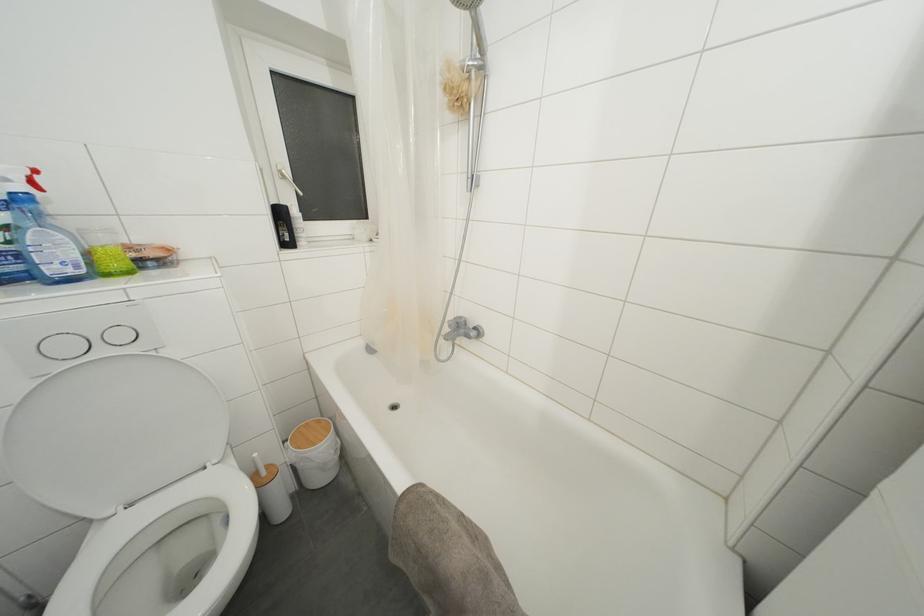
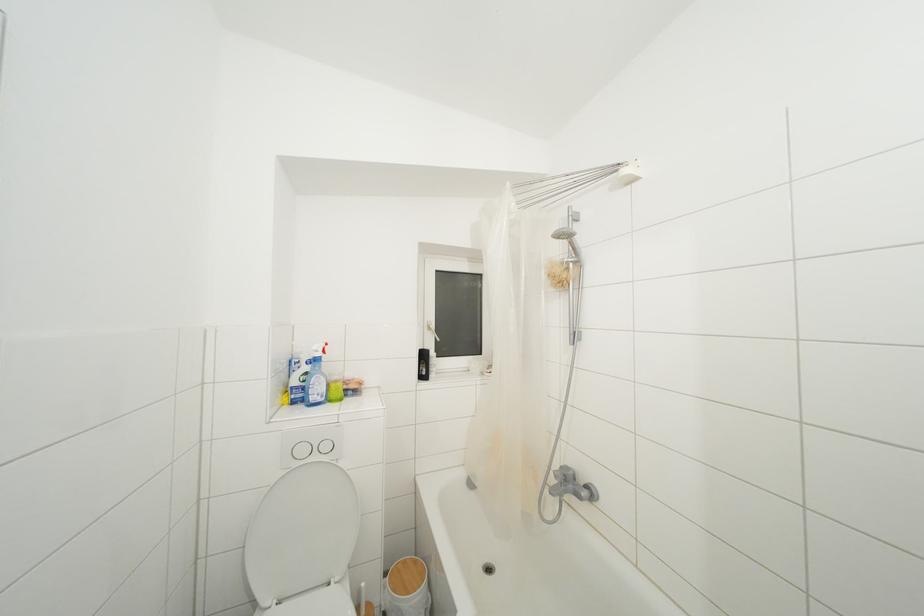
Where in the second image is the point corresponding to (462,328) from the first image?

(568, 480)